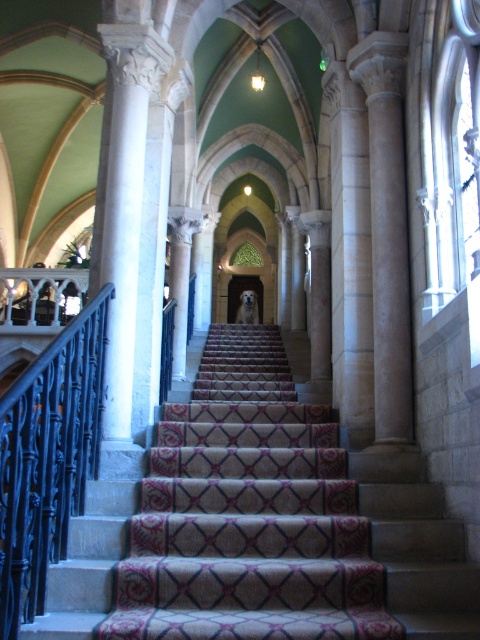
This screenshot has width=480, height=640. Find the location of `carpeted stairs at center`. carpeted stairs at center is located at coordinates (247, 515).

Can you confirm if carpeted stairs at center is shorter than beige stone column at center?

Indeed, carpeted stairs at center has a lesser height compared to beige stone column at center.

This screenshot has width=480, height=640. What do you see at coordinates (247, 515) in the screenshot?
I see `carpeted stairs at center` at bounding box center [247, 515].

Identify the location of carpeted stairs at center. (247, 515).

Can you confirm if white marble column at center is shorter than beige stone column at center?

Incorrect, white marble column at center's height does not fall short of beige stone column at center's.

Is point (129, 301) positioned in front of point (383, 348)?

Yes, it is in front of point (383, 348).

Find the location of `white marble column at center`. white marble column at center is located at coordinates (123, 200).

Is carpeted stairs at center taller than black wrought iron railing at left?

No.

The image size is (480, 640). Identify the location of carpeted stairs at center. (247, 515).

Where is `carpeted stairs at center`? carpeted stairs at center is located at coordinates (247, 515).